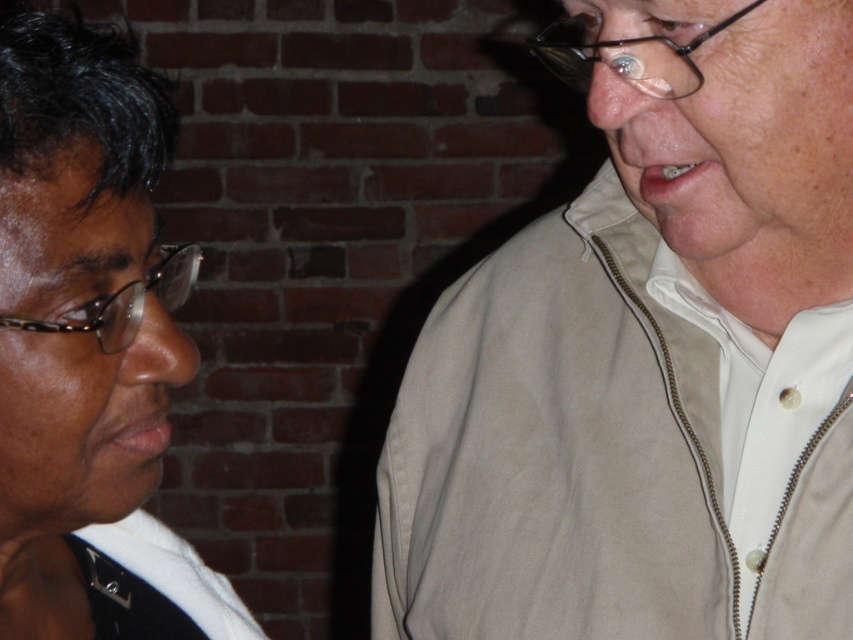
Based on the photo, between beige zip-up jacket at right and black glossy hair at upper left, which one has more height?

Standing taller between the two is beige zip-up jacket at right.

Can you confirm if beige zip-up jacket at right is thinner than black glossy hair at upper left?

→ No.

Find the location of a particular element. This screenshot has height=640, width=853. beige zip-up jacket at right is located at coordinates (648, 355).